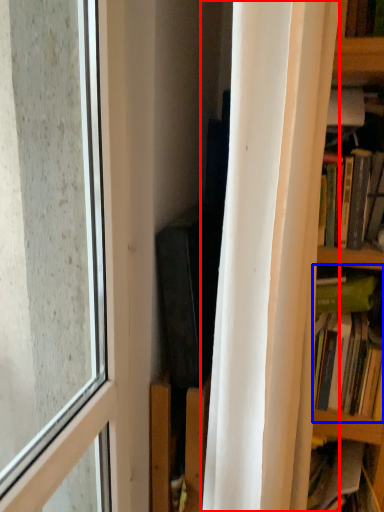
Question: Which point is closer to the camera, curtain (highlighted by a red box) or book (highlighted by a blue box)?

Choices:
 (A) curtain
 (B) book

Answer: (A)